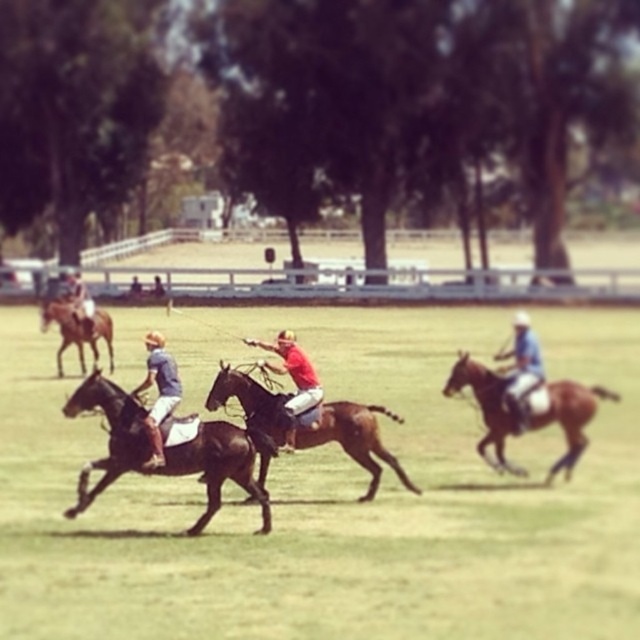
Between black glossy horse at center and brown glossy horse at left, which one has more height?

Standing taller between the two is brown glossy horse at left.

I want to click on black glossy horse at center, so click(164, 451).

Does point (88, 497) come in front of point (68, 324)?

Yes, point (88, 497) is in front of point (68, 324).

I want to click on black glossy horse at center, so click(164, 451).

Does white matte helmet at right lie in front of brown glossy horse at left?

That is True.

Between point (524, 417) and point (74, 314), which one is positioned behind?

The point (74, 314) is behind.

This screenshot has height=640, width=640. Find the location of `white matte helmet at right`. white matte helmet at right is located at coordinates (522, 369).

At what (x,y) coordinates should I click in order to perform the action: click on brown leather horse at center. Please return your answer as a coordinate pair (x, y). Looking at the image, I should click on coord(328,492).

Can you confirm if brown leather horse at center is bigger than white matte helmet at right?

Correct, brown leather horse at center is larger in size than white matte helmet at right.

Is point (76, 458) closer to camera compared to point (509, 355)?

No, it is not.

This screenshot has width=640, height=640. What are the coordinates of `brown leather horse at center` in the screenshot? It's located at (328, 492).